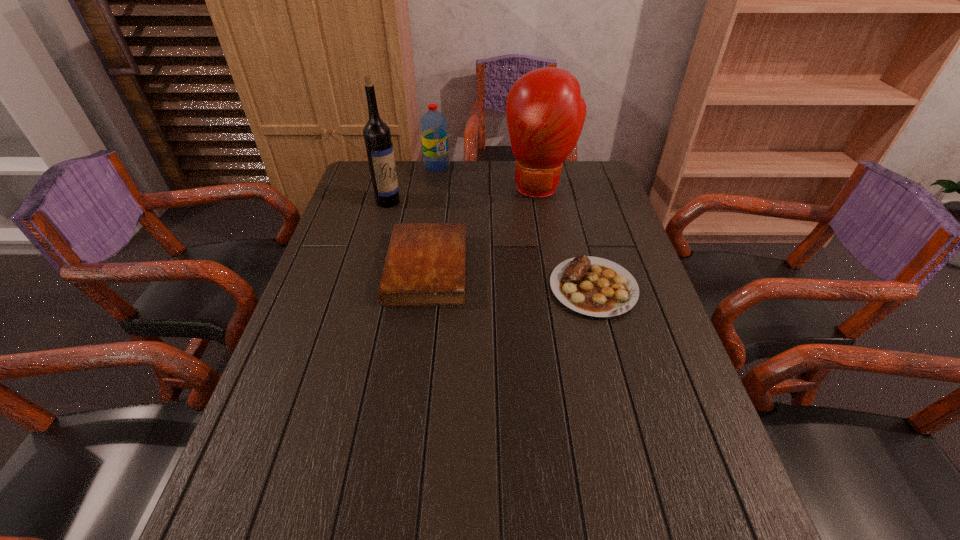
In order to click on free space at the far right corner of the desktop in this screenshot , I will do `click(590, 178)`.

The image size is (960, 540). What are the coordinates of `free space between the boxing glove and the third tallest object` in the screenshot? It's located at (489, 177).

At what (x,y) coordinates should I click in order to perform the action: click on free space between the water bottle and the steak. Please return your answer as a coordinate pair (x, y). Looking at the image, I should click on (516, 227).

I want to click on vacant area between the wine bottle and the boxing glove, so click(464, 194).

Identify the location of vacant area that lies between the boxing glove and the steak. The image size is (960, 540). (566, 238).

Locate an element on the screen. The width and height of the screenshot is (960, 540). empty space that is in between the Bible and the third shortest object is located at coordinates (432, 217).

Locate an element on the screen. The image size is (960, 540). free point between the Bible and the boxing glove is located at coordinates (483, 228).

Image resolution: width=960 pixels, height=540 pixels. I want to click on vacant area that lies between the leftmost object and the boxing glove, so click(464, 194).

Locate an element on the screen. This screenshot has width=960, height=540. vacant area that lies between the boxing glove and the Bible is located at coordinates (483, 228).

You are a GUI agent. You are given a task and a screenshot of the screen. Output one action in this format:
    pyautogui.click(x=<x>, y=<y>)
    Task: Click on the free spot between the third tallest object and the leftmost object
    
    Given the screenshot: What is the action you would take?
    pyautogui.click(x=413, y=184)